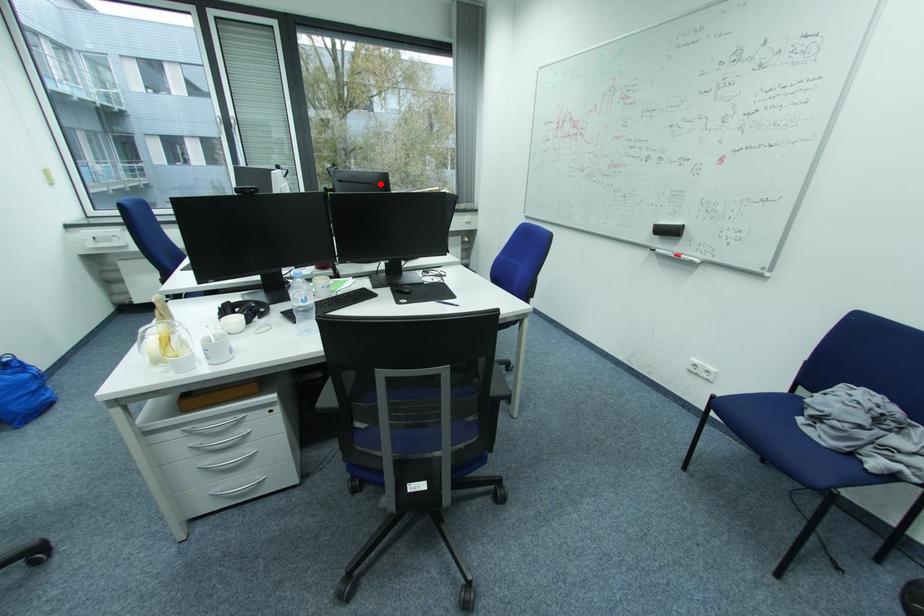
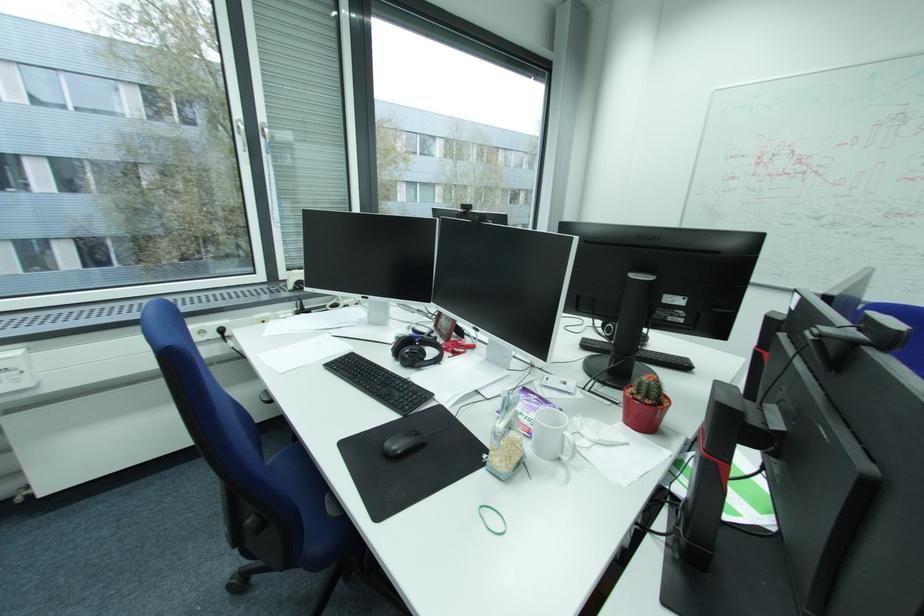
The point at the highlighted location is marked in the first image. Where is the corresponding point in the second image?

(725, 253)